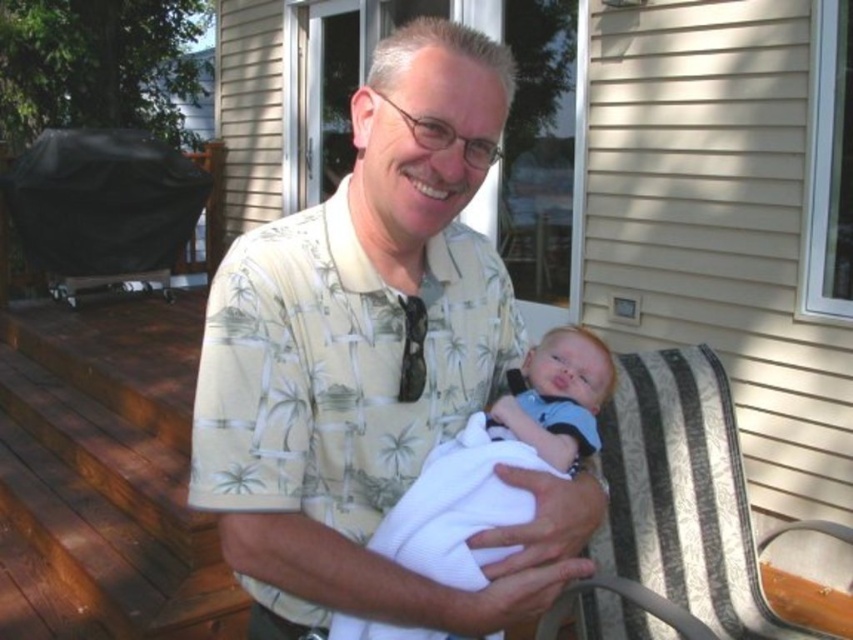
Which is above, brown wood deck at lower left or white clothed baby at center?

white clothed baby at center

Can you confirm if brown wood deck at lower left is taller than white clothed baby at center?

Correct, brown wood deck at lower left is much taller as white clothed baby at center.

The image size is (853, 640). What do you see at coordinates (105, 476) in the screenshot?
I see `brown wood deck at lower left` at bounding box center [105, 476].

Identify the location of brown wood deck at lower left. The height and width of the screenshot is (640, 853). (105, 476).

Does yellow printed shirt at center appear on the right side of matte black tie at center?

Indeed, yellow printed shirt at center is positioned on the right side of matte black tie at center.

Does point (254, 332) come behind point (405, 305)?

No, it is in front of (405, 305).

At what (x,y) coordinates should I click in order to perform the action: click on yellow printed shirt at center. Please return your answer as a coordinate pair (x, y). The image size is (853, 640). Looking at the image, I should click on (372, 362).

Which is behind, point (47, 394) or point (409, 372)?

The point (47, 394) is behind.

Which is more to the right, brown wood deck at lower left or matte black tie at center?

matte black tie at center is more to the right.

Is point (152, 445) positioned after point (402, 353)?

Yes, point (152, 445) is behind point (402, 353).

This screenshot has width=853, height=640. I want to click on brown wood deck at lower left, so click(x=105, y=476).